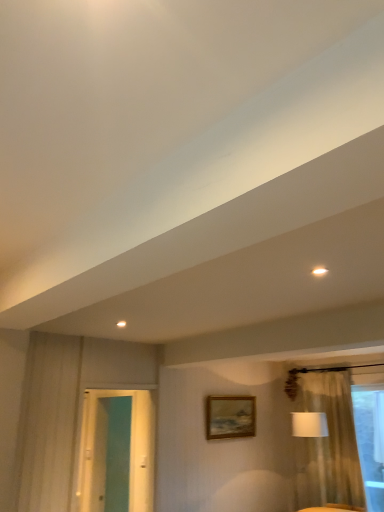
Question: Is beige textured curtain at right positioned behind teal glossy door at left?

Choices:
 (A) yes
 (B) no

Answer: (A)

Question: Is beige textured curtain at right facing away from teal glossy door at left?

Choices:
 (A) yes
 (B) no

Answer: (B)

Question: Does beige textured curtain at right have a smaller size compared to teal glossy door at left?

Choices:
 (A) no
 (B) yes

Answer: (B)

Question: Does beige textured curtain at right have a lesser height compared to teal glossy door at left?

Choices:
 (A) no
 (B) yes

Answer: (A)

Question: From the image's perspective, is beige textured curtain at right above teal glossy door at left?

Choices:
 (A) yes
 (B) no

Answer: (B)

Question: Are beige textured curtain at right and teal glossy door at left located far from each other?

Choices:
 (A) no
 (B) yes

Answer: (B)

Question: Is white glossy light fixture at upper right taller than beige textured curtain at right?

Choices:
 (A) no
 (B) yes

Answer: (A)

Question: Can you confirm if white glossy light fixture at upper right is positioned to the right of beige textured curtain at right?

Choices:
 (A) yes
 (B) no

Answer: (B)

Question: Is white glossy light fixture at upper right positioned in front of beige textured curtain at right?

Choices:
 (A) yes
 (B) no

Answer: (A)

Question: From the image's perspective, is white glossy light fixture at upper right above beige textured curtain at right?

Choices:
 (A) no
 (B) yes

Answer: (B)

Question: Is white glossy light fixture at upper right not close to beige textured curtain at right?

Choices:
 (A) yes
 (B) no

Answer: (A)

Question: From the image's perspective, is white glossy light fixture at upper right located beneath beige textured curtain at right?

Choices:
 (A) no
 (B) yes

Answer: (A)

Question: Can you confirm if white fabric lampshade at right is thinner than white glossy light fixture at upper right?

Choices:
 (A) yes
 (B) no

Answer: (B)